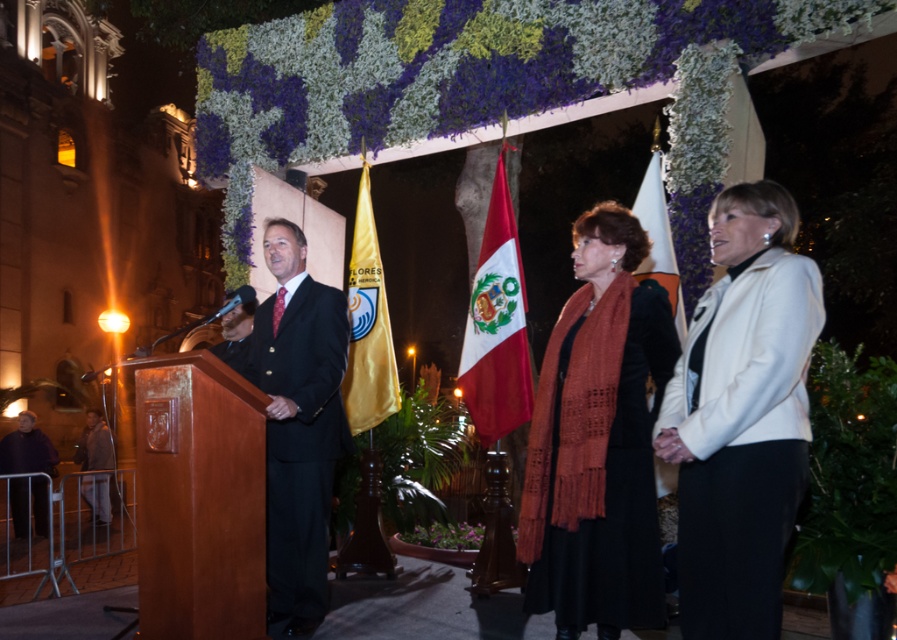
Which of these two, white fabric flag at center or satin black suit at left, stands taller?

white fabric flag at center is taller.

Does white fabric flag at center appear over satin black suit at left?

Indeed, white fabric flag at center is positioned over satin black suit at left.

Which is in front, point (660, 224) or point (238, 346)?

Point (660, 224) is in front.

This screenshot has height=640, width=897. In order to click on white fabric flag at center in this screenshot , I will do `click(658, 237)`.

Does black satin suit at left have a greater height compared to dark gray fabric uniform at left?

Indeed, black satin suit at left has a greater height compared to dark gray fabric uniform at left.

Does point (264, 385) come farther from viewer compared to point (103, 477)?

That is False.

The image size is (897, 640). I want to click on black satin suit at left, so pyautogui.click(x=301, y=440).

Can you confirm if black satin suit at left is wider than white fabric flag at center?

Yes, black satin suit at left is wider than white fabric flag at center.

Between black satin suit at left and white fabric flag at center, which one has more height?

black satin suit at left is taller.

Is point (323, 572) closer to viewer compared to point (658, 196)?

Yes, it is.

Locate an element on the screen. black satin suit at left is located at coordinates (301, 440).